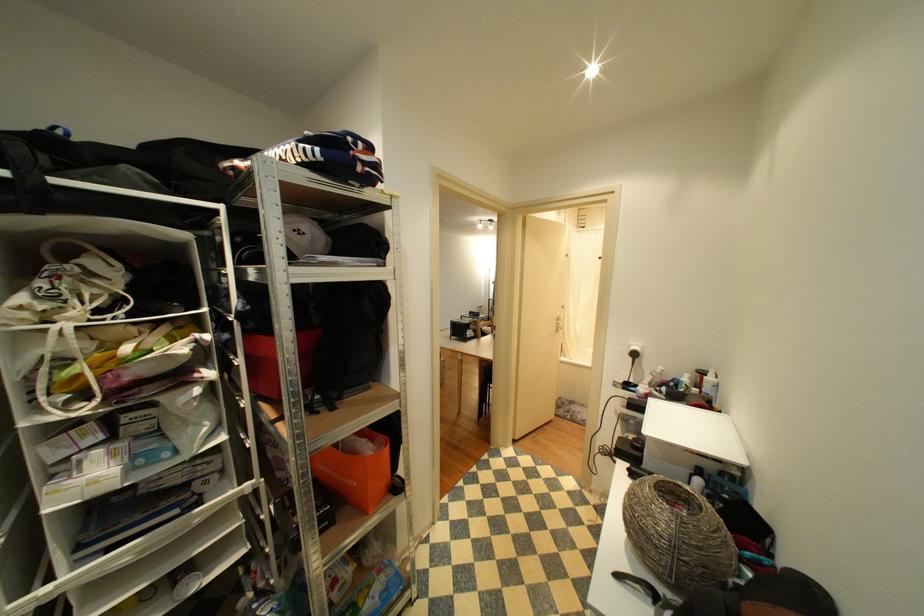
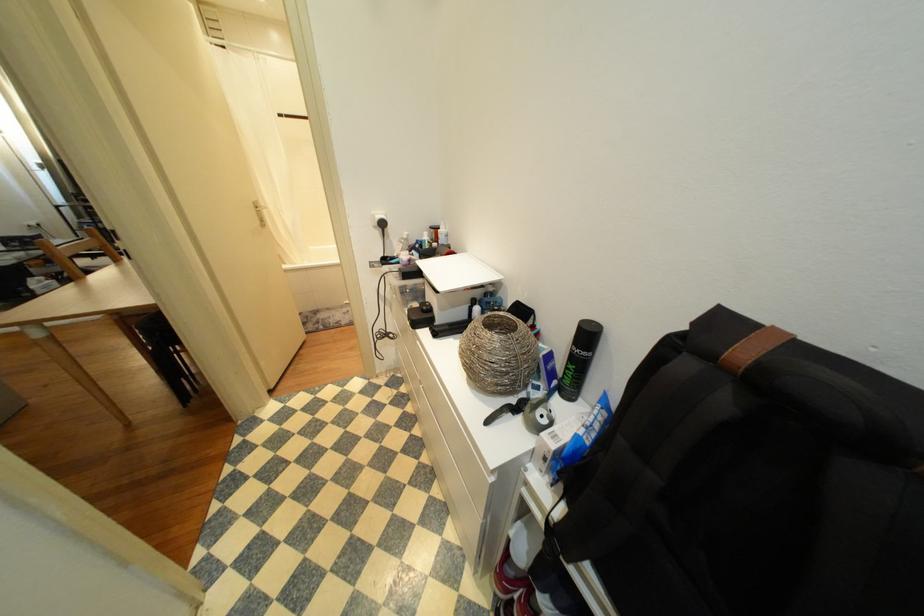
Locate, in the second image, the point that corresponds to pixel 636 572 in the first image.

(496, 411)